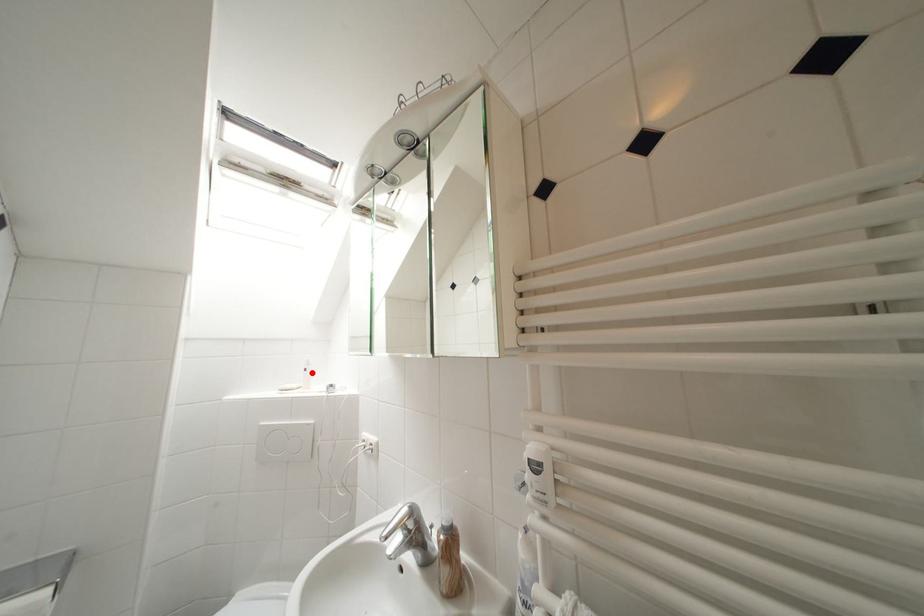
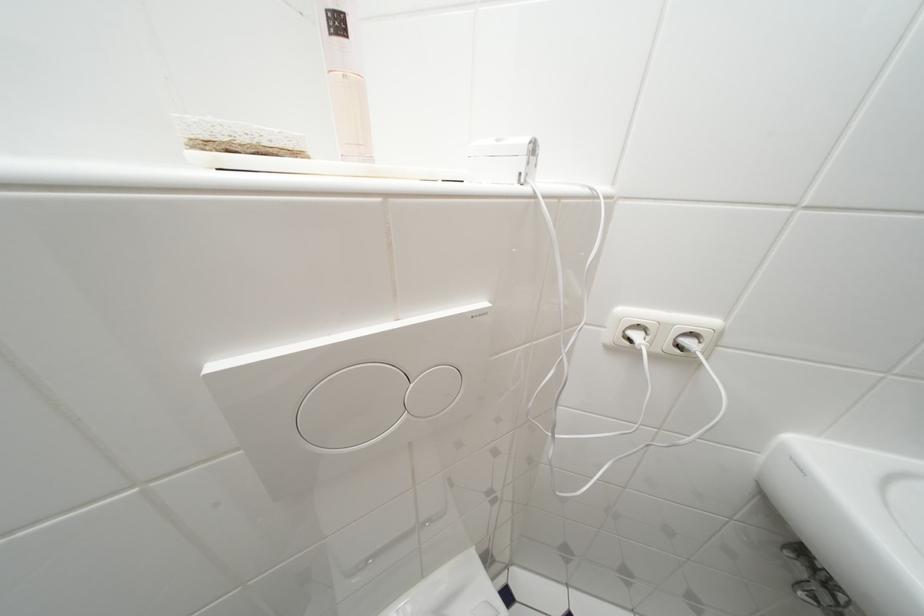
Find the pixel in the second image that matches the highlighted location in the first image.

(345, 26)